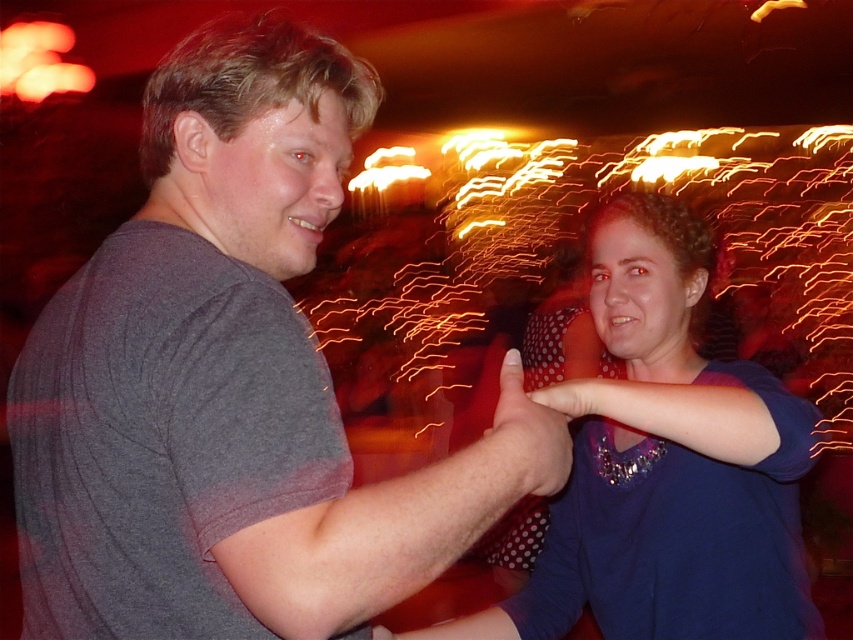
Is gray cotton t-shirt at left taller than polka dot fabric hand at center?

Indeed, gray cotton t-shirt at left has a greater height compared to polka dot fabric hand at center.

Which of these two, gray cotton t-shirt at left or polka dot fabric hand at center, stands shorter?

polka dot fabric hand at center is shorter.

Identify the location of gray cotton t-shirt at left. (218, 381).

Who is more forward, (456, 634) or (517, 458)?

Point (517, 458)

How far apart are blue dotted shirt at center and polka dot fabric hand at center?

blue dotted shirt at center is 14.48 inches from polka dot fabric hand at center.

The image size is (853, 640). In order to click on blue dotted shirt at center in this screenshot , I will do `click(665, 465)`.

Between gray cotton t-shirt at left and blue dotted shirt at center, which one is positioned higher?

gray cotton t-shirt at left is higher up.

Does point (74, 452) come in front of point (604, 532)?

Yes, it is.

This screenshot has height=640, width=853. Identify the location of gray cotton t-shirt at left. (218, 381).